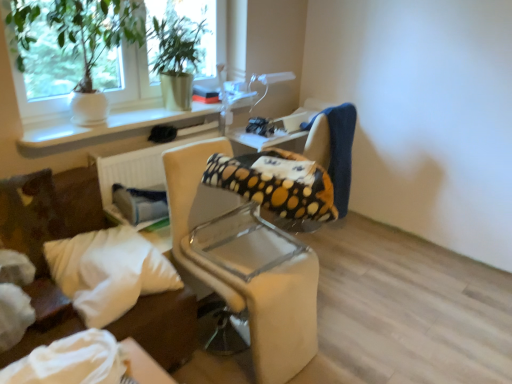
Question: From a real-world perspective, is polka dot fabric chair at center, positioned as the 1th chair in back-to-front order, on top of white soft pillow at lower left?

Choices:
 (A) yes
 (B) no

Answer: (B)

Question: Would you say polka dot fabric chair at center, positioned as the 1th chair in back-to-front order, is outside white soft pillow at lower left?

Choices:
 (A) yes
 (B) no

Answer: (A)

Question: Does polka dot fabric chair at center, positioned as the 1th chair in back-to-front order, have a lesser width compared to white soft pillow at lower left?

Choices:
 (A) no
 (B) yes

Answer: (A)

Question: Is polka dot fabric chair at center, the 2th chair from the front, facing towards white soft pillow at lower left?

Choices:
 (A) yes
 (B) no

Answer: (B)

Question: Is polka dot fabric chair at center, the 2th chair from the front, bigger than white soft pillow at lower left?

Choices:
 (A) yes
 (B) no

Answer: (A)

Question: Do you think green leafy plant in white pot at upper left, positioned as the 1th houseplant in left-to-right order, is within white ceramic vase at upper left, or outside of it?

Choices:
 (A) inside
 (B) outside

Answer: (B)

Question: From the image's perspective, relative to white ceramic vase at upper left, is green leafy plant in white pot at upper left, which is the second houseplant in right-to-left order, above or below?

Choices:
 (A) below
 (B) above

Answer: (B)

Question: Is point click(x=103, y=19) closer or farther from the camera than point click(x=207, y=107)?

Choices:
 (A) closer
 (B) farther

Answer: (A)

Question: Is green leafy plant in white pot at upper left, which is the second houseplant in right-to-left order, to the left or to the right of white ceramic vase at upper left in the image?

Choices:
 (A) right
 (B) left

Answer: (B)

Question: From the image's perspective, is beige fabric chair at center, which appears as the 1th chair when viewed from the front, positioned above or below green leafy plant in white pot at upper left, which is the second houseplant in right-to-left order?

Choices:
 (A) above
 (B) below

Answer: (B)

Question: Is beige fabric chair at center, the 2th chair when ordered from back to front, bigger or smaller than green leafy plant in white pot at upper left, which is the second houseplant in right-to-left order?

Choices:
 (A) small
 (B) big

Answer: (B)

Question: Would you say beige fabric chair at center, the 2th chair when ordered from back to front, is inside or outside green leafy plant in white pot at upper left, positioned as the 1th houseplant in left-to-right order?

Choices:
 (A) inside
 (B) outside

Answer: (B)

Question: In the image, is beige fabric chair at center, the 2th chair when ordered from back to front, on the left side or the right side of green leafy plant in white pot at upper left, which is the second houseplant in right-to-left order?

Choices:
 (A) right
 (B) left

Answer: (A)

Question: From the image's perspective, is green matte plant at upper left, placed as the 2th houseplant when sorted from left to right, located above or below green leafy plant in white pot at upper left, which is the second houseplant in right-to-left order?

Choices:
 (A) below
 (B) above

Answer: (B)

Question: Visually, is green matte plant at upper left, placed as the 2th houseplant when sorted from left to right, positioned to the left or to the right of green leafy plant in white pot at upper left, which is the second houseplant in right-to-left order?

Choices:
 (A) right
 (B) left

Answer: (A)